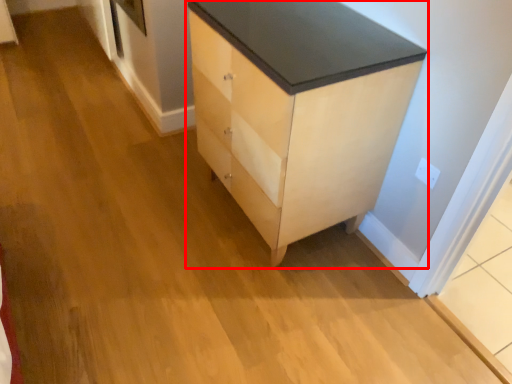
Question: In this image, where is chest of drawers (annotated by the red box) located relative to electric outlet?

Choices:
 (A) left
 (B) right

Answer: (A)